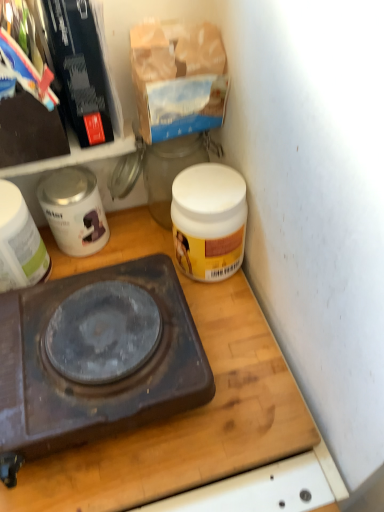
Question: From the image's perspective, would you say white glossy canister at upper left, the 2th appliance positioned from the left, is positioned over dark brown plastic gas stove at center?

Choices:
 (A) yes
 (B) no

Answer: (A)

Question: Does white glossy canister at upper left, placed as the first appliance when sorted from right to left, appear on the left side of dark brown plastic gas stove at center?

Choices:
 (A) yes
 (B) no

Answer: (A)

Question: Is white glossy canister at upper left, placed as the first appliance when sorted from right to left, directly adjacent to dark brown plastic gas stove at center?

Choices:
 (A) no
 (B) yes

Answer: (A)

Question: Is white glossy canister at upper left, the 2th appliance positioned from the left, bigger than dark brown plastic gas stove at center?

Choices:
 (A) no
 (B) yes

Answer: (A)

Question: Is white glossy canister at upper left, placed as the first appliance when sorted from right to left, positioned in front of dark brown plastic gas stove at center?

Choices:
 (A) no
 (B) yes

Answer: (A)

Question: From a real-world perspective, is dark brown plastic gas stove at center physically located above or below wooden cutting board at center?

Choices:
 (A) above
 (B) below

Answer: (A)

Question: Would you say dark brown plastic gas stove at center is to the left or to the right of wooden cutting board at center in the picture?

Choices:
 (A) left
 (B) right

Answer: (A)

Question: In the image, is dark brown plastic gas stove at center positioned in front of or behind wooden cutting board at center?

Choices:
 (A) behind
 (B) front

Answer: (B)

Question: Does point (82, 428) appear closer or farther from the camera than point (284, 456)?

Choices:
 (A) closer
 (B) farther

Answer: (A)

Question: Considering the positions of wooden cutting board at center and dark brown plastic gas stove at center in the image, is wooden cutting board at center wider or thinner than dark brown plastic gas stove at center?

Choices:
 (A) thin
 (B) wide

Answer: (B)

Question: Is wooden cutting board at center to the left or to the right of dark brown plastic gas stove at center in the image?

Choices:
 (A) right
 (B) left

Answer: (A)

Question: From their relative heights in the image, would you say wooden cutting board at center is taller or shorter than dark brown plastic gas stove at center?

Choices:
 (A) short
 (B) tall

Answer: (A)

Question: Considering the positions of wooden cutting board at center and dark brown plastic gas stove at center in the image, is wooden cutting board at center bigger or smaller than dark brown plastic gas stove at center?

Choices:
 (A) small
 (B) big

Answer: (A)

Question: From the image's perspective, relative to white glossy canister at upper left, the 2th appliance positioned from the left, is dark brown plastic gas stove at center above or below?

Choices:
 (A) below
 (B) above

Answer: (A)

Question: Considering their positions, is dark brown plastic gas stove at center located in front of or behind white glossy canister at upper left, placed as the first appliance when sorted from right to left?

Choices:
 (A) front
 (B) behind

Answer: (A)